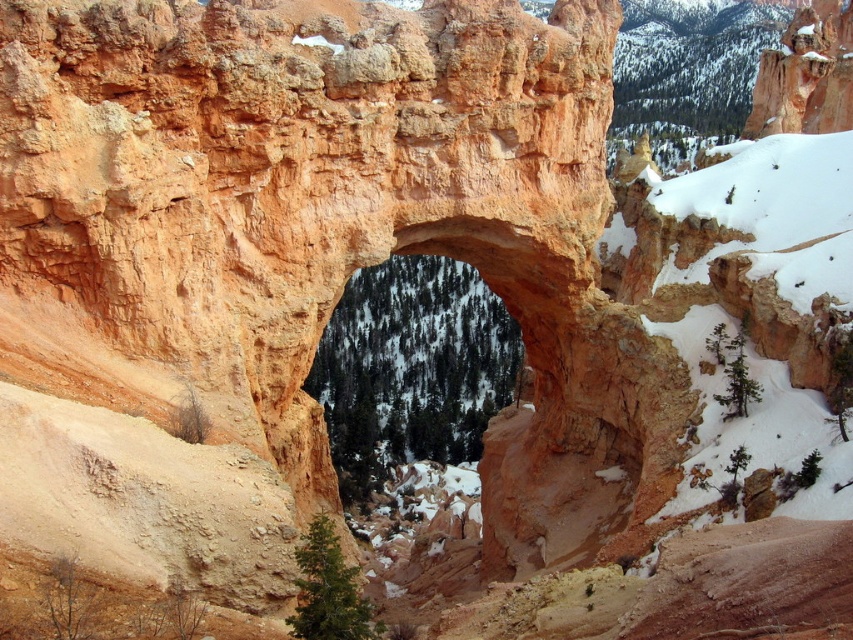
You are a hiker standing at the base of the natural arch and see the green matte tree at lower center and the green matte tree at upper right. Which tree is nearer to you?

The green matte tree at lower center is closer to the viewer than the green matte tree at upper right.

You are standing at the base of the sandstone arch and want to take a photo that includes both the natural arch and the snowcovered forest beyond it. Which of the two points, point (x=354, y=481) or point (x=323, y=538), is closer to the camera when capturing this view?

Point (x=323, y=538) is closer to the camera because it is positioned nearer than point (x=354, y=481), which is further away in the scene.